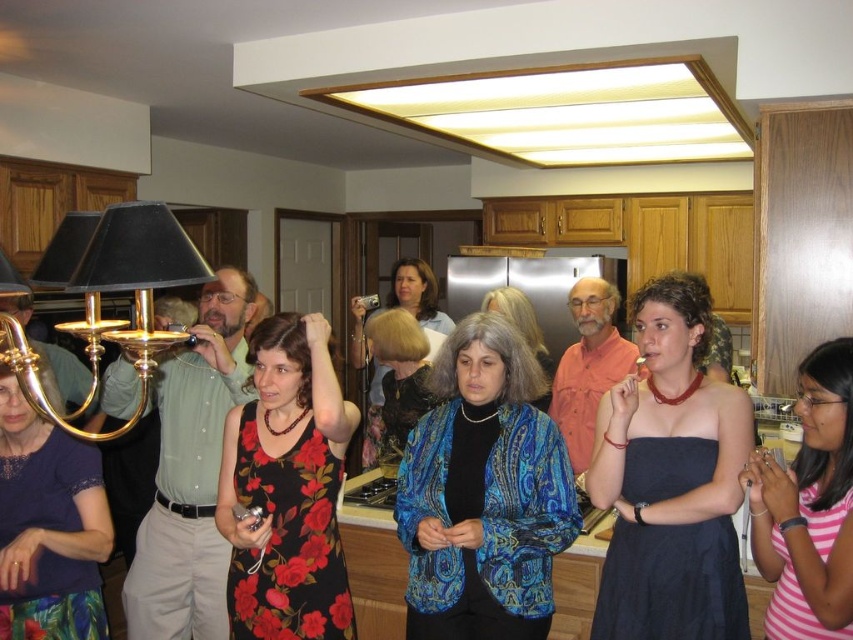
You are a photographer at a party and want to take a picture of the pink striped dress at lower right and the gold brass chandelier at upper left. Can you frame both objects in a single shot without moving either of them?

The pink striped dress at lower right is below the gold brass chandelier at upper left, so yes, you can frame both in a single shot by adjusting the camera angle to include both the lower and upper areas of the scene.

You are standing in the kitchen and want to take a photo of the group of people. The point where you should aim your camera to capture the group is at point coordinates point [477,547]. Given that this point is 6.31 feet away from you, is it within the 8 feet range of your camera lens?

The point [477,547] is 6.31 feet away from the viewer, so yes, it is within the 8 feet range of the camera lens since 6.31 feet is less than 8 feet.